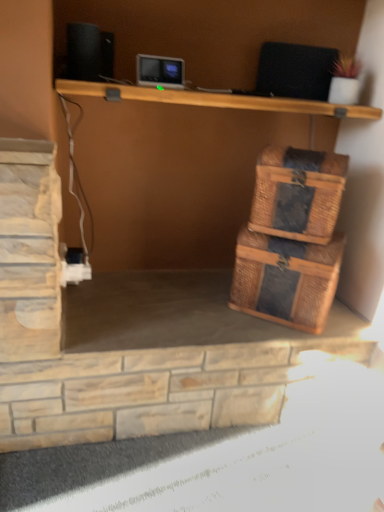
Question: Would you say rattan woven storage box at lower right is outside rattan basket at right?

Choices:
 (A) no
 (B) yes

Answer: (B)

Question: Does rattan woven storage box at lower right lie behind rattan basket at right?

Choices:
 (A) yes
 (B) no

Answer: (A)

Question: Would you say rattan woven storage box at lower right is a long distance from rattan basket at right?

Choices:
 (A) yes
 (B) no

Answer: (B)

Question: From the image's perspective, is rattan woven storage box at lower right below rattan basket at right?

Choices:
 (A) no
 (B) yes

Answer: (B)

Question: Can you confirm if rattan woven storage box at lower right is thinner than rattan basket at right?

Choices:
 (A) yes
 (B) no

Answer: (B)

Question: Considering the relative positions of rattan woven storage box at lower right and rattan basket at right in the image provided, is rattan woven storage box at lower right to the right of rattan basket at right from the viewer's perspective?

Choices:
 (A) no
 (B) yes

Answer: (A)

Question: Is rattan basket at right completely or partially outside of rattan woven storage box at lower right?

Choices:
 (A) yes
 (B) no

Answer: (A)

Question: From a real-world perspective, is rattan basket at right physically below rattan woven storage box at lower right?

Choices:
 (A) yes
 (B) no

Answer: (B)

Question: From the image's perspective, is rattan basket at right over rattan woven storage box at lower right?

Choices:
 (A) yes
 (B) no

Answer: (A)

Question: From the image's perspective, is rattan basket at right under rattan woven storage box at lower right?

Choices:
 (A) yes
 (B) no

Answer: (B)

Question: Is rattan basket at right behind rattan woven storage box at lower right?

Choices:
 (A) yes
 (B) no

Answer: (B)

Question: Can you confirm if rattan basket at right is taller than rattan woven storage box at lower right?

Choices:
 (A) no
 (B) yes

Answer: (A)

Question: From the image's perspective, is black matte speaker at upper left on top of rattan basket at right?

Choices:
 (A) yes
 (B) no

Answer: (A)